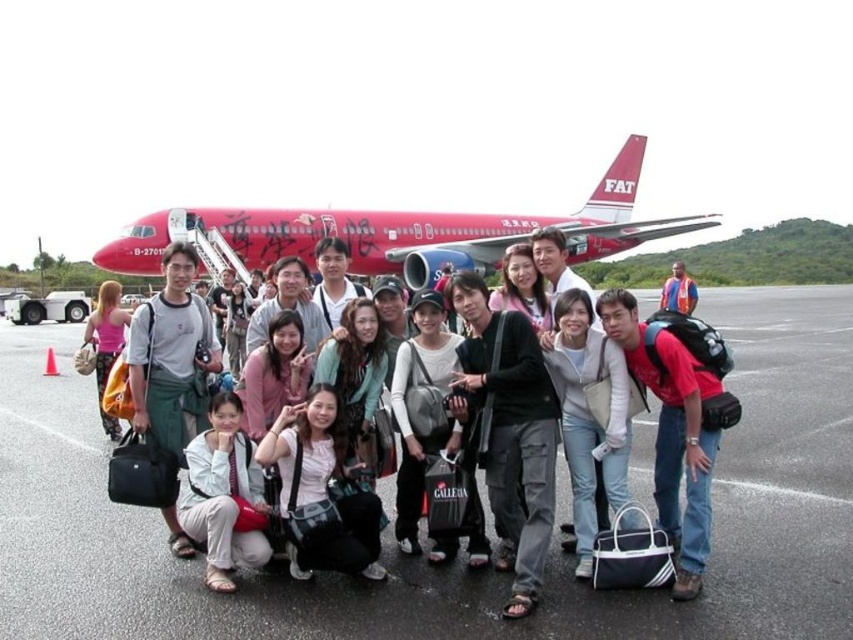
You are standing at the center of the image and want to place a small marker on the black asphalt at center. What are the coordinates where you should place it?

The coordinates for placing the marker on the black asphalt at center are 0.861 in the x direction and 0.540 in the y direction.

You are standing in front of the red airplane with the registration number B2701. There are two points marked on the plane. The first point is at coordinate (285,448) and the second at (613,442). If you were to walk towards the plane, which point would appear closer to you?

The point at coordinate (285,448) is closer to the viewer than point (613,442), so it would appear closer when you walk towards the plane.

You are a photographer standing in front of the red airplane. You notice the black asphalt at center and the white fabric pants at lower center in your viewfinder. Which object is nearer to you?

The black asphalt at center is closer to the viewer than the white fabric pants at lower center.